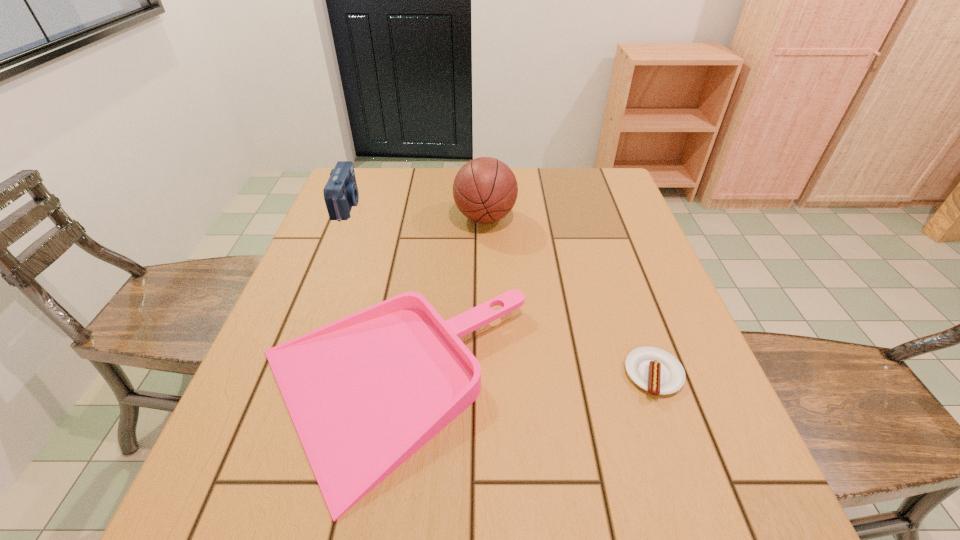
Where is `basketball`? Image resolution: width=960 pixels, height=540 pixels. basketball is located at coordinates (485, 189).

Where is `camera`? camera is located at coordinates (341, 192).

The height and width of the screenshot is (540, 960). I want to click on the second shortest object, so click(365, 392).

At what (x,y) coordinates should I click in order to perform the action: click on the rightmost object. Please return your answer as a coordinate pair (x, y). The height and width of the screenshot is (540, 960). Looking at the image, I should click on (655, 370).

Find the location of `sausage`. sausage is located at coordinates (655, 370).

This screenshot has width=960, height=540. I want to click on vacant space situated on the right of the basketball, so click(583, 218).

Where is `free space located on the lens of the second tallest object`? The height and width of the screenshot is (540, 960). free space located on the lens of the second tallest object is located at coordinates (379, 205).

Identify the location of free space located on the left of the rightmost object. The height and width of the screenshot is (540, 960). (539, 374).

Image resolution: width=960 pixels, height=540 pixels. I want to click on basketball situated at the far edge, so click(485, 189).

Locate an element on the screen. camera located at the far edge is located at coordinates (341, 192).